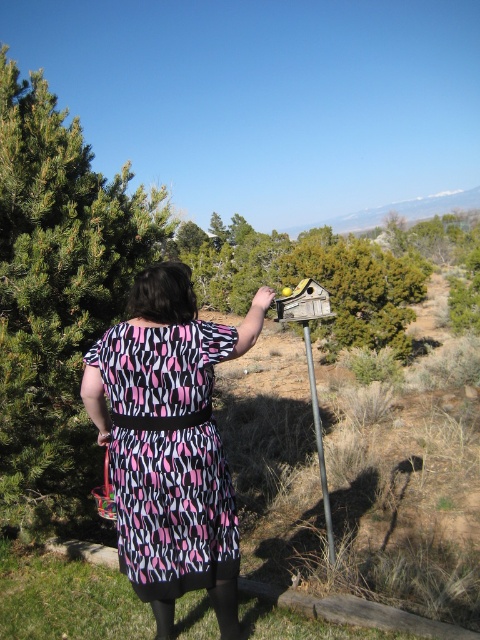
Question: Is green leafy tree at left wider than metallic pole at center?

Choices:
 (A) yes
 (B) no

Answer: (B)

Question: Does pink and black dotted fabric dress at center come in front of metallic pole at center?

Choices:
 (A) no
 (B) yes

Answer: (B)

Question: Which object is the closest to the pink and black dotted fabric dress at center?

Choices:
 (A) green leafy tree at left
 (B) metallic pole at center

Answer: (B)

Question: Can you confirm if green leafy tree at left is smaller than pink and black dotted fabric dress at center?

Choices:
 (A) yes
 (B) no

Answer: (A)

Question: Considering the real-world distances, which object is closest to the pink and black dotted fabric dress at center?

Choices:
 (A) metallic pole at center
 (B) green leafy tree at left

Answer: (A)

Question: Among these objects, which one is farthest from the camera?

Choices:
 (A) pink and black dotted fabric dress at center
 (B) metallic pole at center
 (C) green leafy tree at left

Answer: (C)